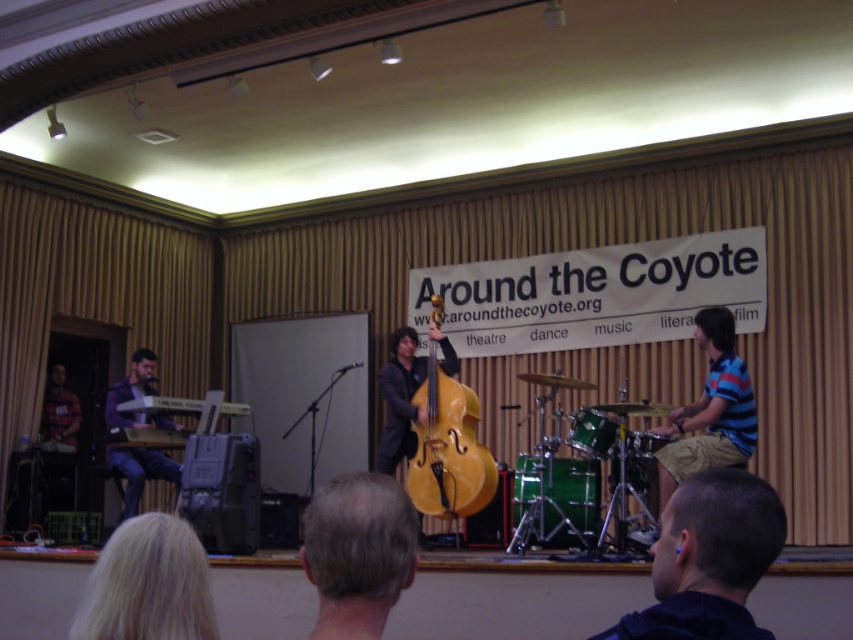
Consider the image. You are attending a live music performance at a community center and notice a musician wearing a blue striped shirt at right. Where exactly is this musician positioned on the stage?

The blue striped shirt at right is located at point [711,410].

You are a photographer at the event and want to capture the keyboardist in the foreground and the banner in the background. The banner is at the back wall. The keyboardist is at point (711, 410). Is the keyboardist closer to the camera than the banner?

The point (711, 410) is on the blue striped shirt at right, so the keyboardist is closer to the camera than the banner which is on the back wall.

You are a photographer at the event and need to capture a photo of the golden polished wood cello at center without the dark blue hoodie at lower right blocking it. What should you do?

Move to the side so that the dark blue hoodie at lower right is no longer in front of the golden polished wood cello at center, as the dark blue hoodie at lower right is currently positioned over it.